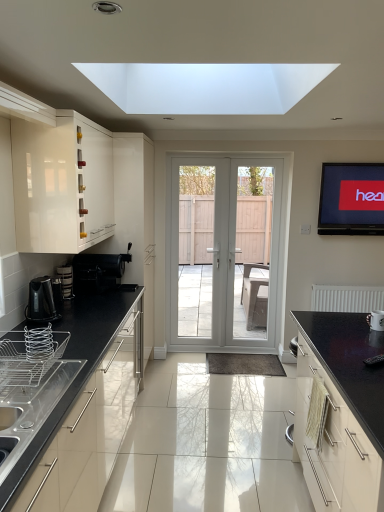
Question: Is white glossy screen door at center, the 2th screen door from the right, not within glossy black countertop at right, which ranks as the first cabinetry in bottom-to-top order?

Choices:
 (A) yes
 (B) no

Answer: (A)

Question: Is white glossy screen door at center, the 2th screen door from the right, positioned before glossy black countertop at right, which ranks as the first cabinetry in bottom-to-top order?

Choices:
 (A) yes
 (B) no

Answer: (B)

Question: Is glossy black countertop at right, which ranks as the first cabinetry in bottom-to-top order, located within white glossy screen door at center, which ranks as the first screen door in left-to-right order?

Choices:
 (A) yes
 (B) no

Answer: (B)

Question: Is white glossy screen door at center, the 2th screen door from the right, smaller than glossy black countertop at right, acting as the 1th cabinetry starting from the right?

Choices:
 (A) yes
 (B) no

Answer: (A)

Question: From a real-world perspective, is white glossy screen door at center, the 2th screen door from the right, over glossy black countertop at right, placed as the second cabinetry when sorted from top to bottom?

Choices:
 (A) no
 (B) yes

Answer: (B)

Question: Does white glossy screen door at center, the 2th screen door from the right, have a lesser height compared to glossy black countertop at right, which ranks as the first cabinetry in bottom-to-top order?

Choices:
 (A) no
 (B) yes

Answer: (A)

Question: From the image's perspective, is white matte radiator at right over silver metallic wire basket at lower left, which appears as the first appliance when viewed from the front?

Choices:
 (A) no
 (B) yes

Answer: (A)

Question: Considering the relative positions of white matte radiator at right and silver metallic wire basket at lower left, which appears as the first appliance when viewed from the front, in the image provided, is white matte radiator at right in front of silver metallic wire basket at lower left, which appears as the first appliance when viewed from the front,?

Choices:
 (A) yes
 (B) no

Answer: (B)

Question: Is white matte radiator at right shorter than silver metallic wire basket at lower left, which appears as the first appliance when viewed from the front?

Choices:
 (A) no
 (B) yes

Answer: (A)

Question: Can you confirm if white matte radiator at right is positioned to the left of silver metallic wire basket at lower left, which ranks as the 3th appliance in back-to-front order?

Choices:
 (A) yes
 (B) no

Answer: (B)

Question: Can you confirm if white matte radiator at right is positioned to the right of silver metallic wire basket at lower left, which appears as the first appliance when viewed from the front?

Choices:
 (A) no
 (B) yes

Answer: (B)

Question: Is white matte radiator at right thinner than silver metallic wire basket at lower left, which is the 2th appliance in right-to-left order?

Choices:
 (A) yes
 (B) no

Answer: (A)

Question: Can you confirm if white glossy door at center is smaller than matte black tv at upper right?

Choices:
 (A) yes
 (B) no

Answer: (B)